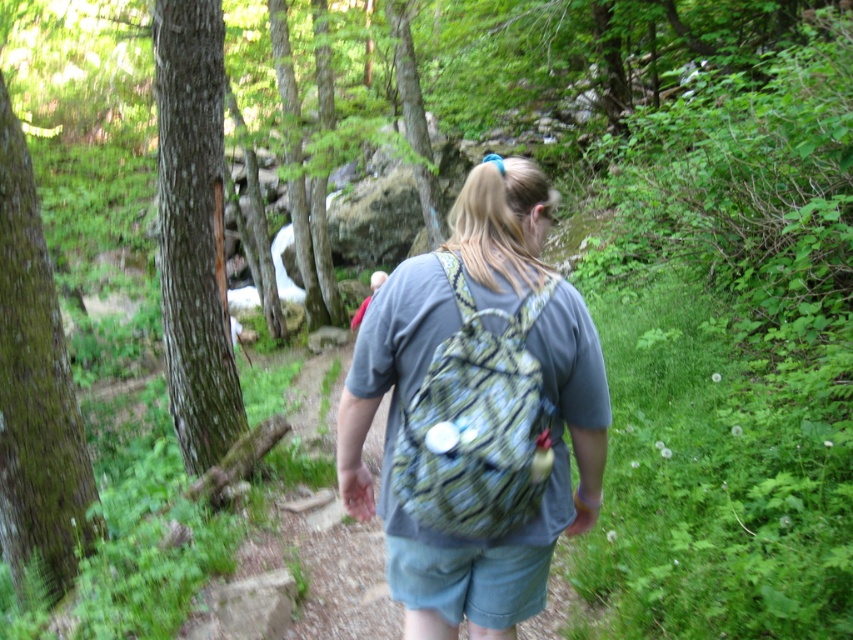
Which is behind, point (566, 308) or point (503, 340)?

Positioned behind is point (566, 308).

Describe the element at coordinates (477, 412) in the screenshot. I see `printed fabric backpack at center` at that location.

At what (x,y) coordinates should I click in order to perform the action: click on printed fabric backpack at center. Please return your answer as a coordinate pair (x, y). This screenshot has width=853, height=640. Looking at the image, I should click on (477, 412).

At what (x,y) coordinates should I click in order to perform the action: click on printed fabric backpack at center. Please return your answer as a coordinate pair (x, y). This screenshot has width=853, height=640. Looking at the image, I should click on pos(477,412).